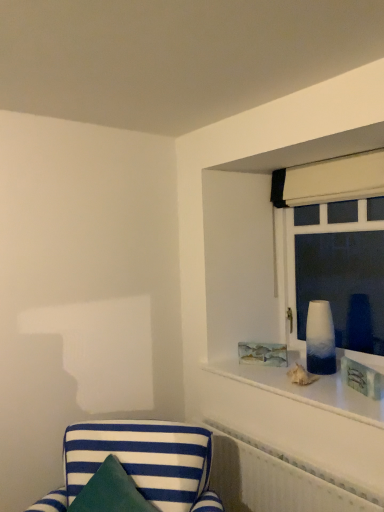
Question: Is white textured radiator at lower right with blue and white striped fabric chair at lower left?

Choices:
 (A) yes
 (B) no

Answer: (B)

Question: Does white textured radiator at lower right have a greater height compared to blue and white striped fabric chair at lower left?

Choices:
 (A) no
 (B) yes

Answer: (B)

Question: From a real-world perspective, is white textured radiator at lower right below blue and white striped fabric chair at lower left?

Choices:
 (A) yes
 (B) no

Answer: (A)

Question: Is white textured radiator at lower right outside blue and white striped fabric chair at lower left?

Choices:
 (A) yes
 (B) no

Answer: (A)

Question: Does white textured radiator at lower right appear on the right side of blue and white striped fabric chair at lower left?

Choices:
 (A) yes
 (B) no

Answer: (A)

Question: From a real-world perspective, is white textured radiator at lower right positioned over blue and white striped fabric chair at lower left based on gravity?

Choices:
 (A) no
 (B) yes

Answer: (A)

Question: Is ombre glass vase at upper right turned away from blue and white striped fabric chair at lower left?

Choices:
 (A) yes
 (B) no

Answer: (B)

Question: Is ombre glass vase at upper right with blue and white striped fabric chair at lower left?

Choices:
 (A) no
 (B) yes

Answer: (A)

Question: From the image's perspective, does ombre glass vase at upper right appear higher than blue and white striped fabric chair at lower left?

Choices:
 (A) yes
 (B) no

Answer: (A)

Question: Does ombre glass vase at upper right appear on the right side of blue and white striped fabric chair at lower left?

Choices:
 (A) yes
 (B) no

Answer: (A)

Question: Would you say ombre glass vase at upper right is outside blue and white striped fabric chair at lower left?

Choices:
 (A) yes
 (B) no

Answer: (A)

Question: Can you confirm if ombre glass vase at upper right is bigger than blue and white striped fabric chair at lower left?

Choices:
 (A) yes
 (B) no

Answer: (B)

Question: Is matte wooden picture frame at upper right surrounding white fabric curtain at upper right?

Choices:
 (A) no
 (B) yes

Answer: (A)